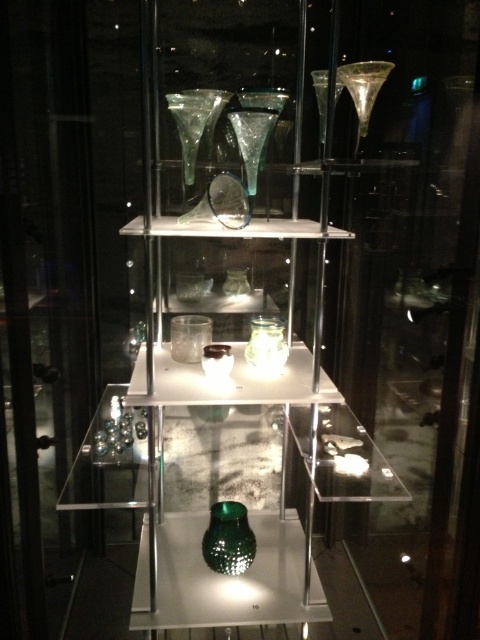
Question: Which object appears closest to the camera in this image?

Choices:
 (A) green textured glass vase at lower center
 (B) translucent glass jar at center
 (C) transparent glass vase at upper center
 (D) green textured glass at center

Answer: (D)

Question: Is transparent glass vase at upper center wider than translucent glass jar at center?

Choices:
 (A) no
 (B) yes

Answer: (A)

Question: Which of the following is the farthest from the observer?

Choices:
 (A) transparent glass vase at upper center
 (B) translucent glass jar at center
 (C) green textured glass at center
 (D) green textured glass vase at lower center

Answer: (D)

Question: Is green textured glass at center bigger than translucent glass jar at center?

Choices:
 (A) yes
 (B) no

Answer: (A)

Question: Which of the following is the farthest from the observer?

Choices:
 (A) green textured glass vase at lower center
 (B) translucent glass jar at center
 (C) transparent glass vase at upper center

Answer: (A)

Question: Is green textured glass at center closer to the viewer compared to translucent glass jar at center?

Choices:
 (A) no
 (B) yes

Answer: (B)